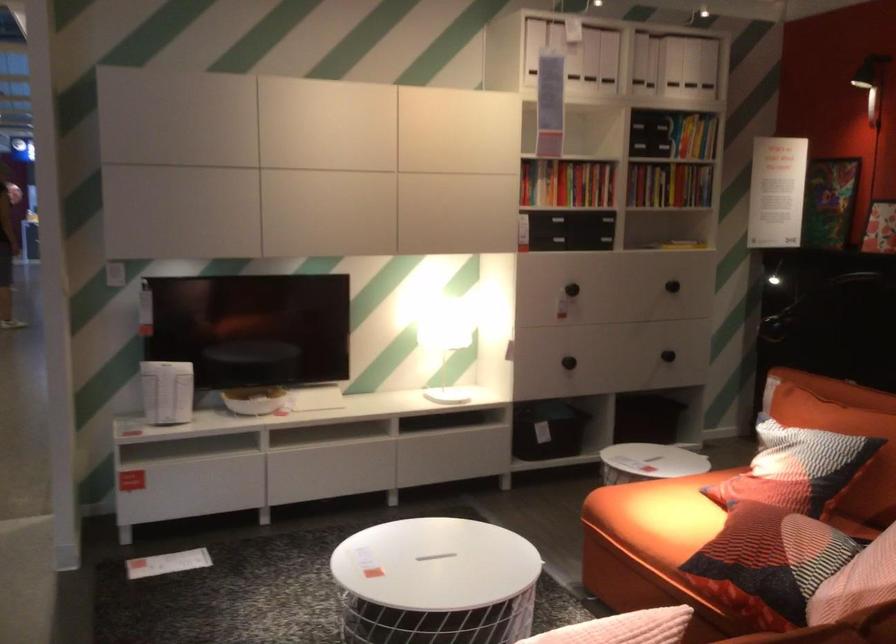
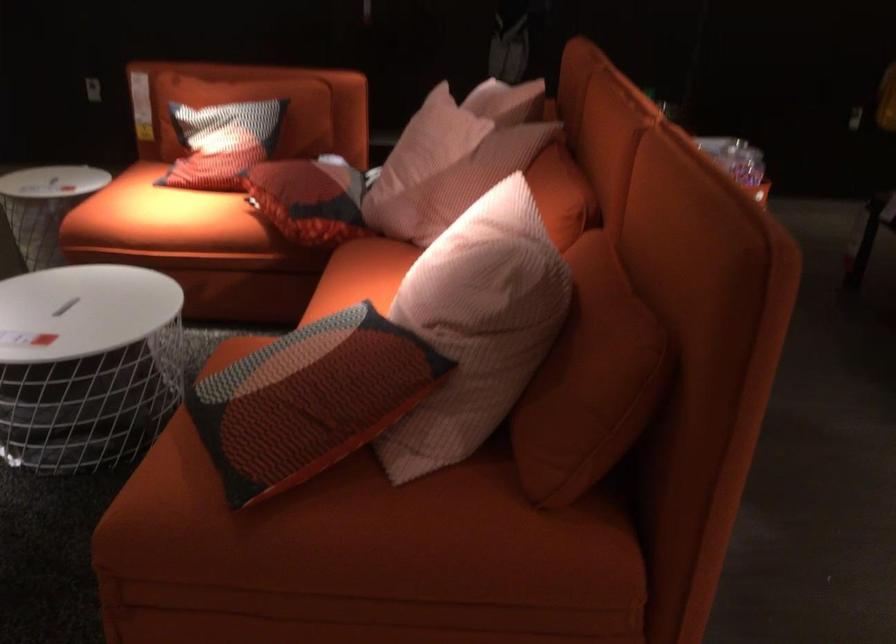
Where in the second image is the point corresponding to [779,462] from the first image?

(222, 142)